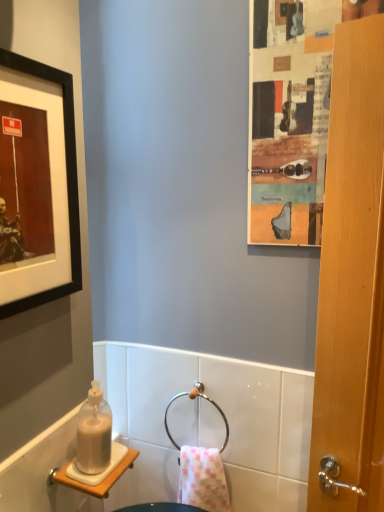
What do you see at coordinates (202, 479) in the screenshot? The width and height of the screenshot is (384, 512). I see `pink checkered towel at center` at bounding box center [202, 479].

Locate an element on the screen. This screenshot has width=384, height=512. translucent plastic bottle at lower left is located at coordinates (94, 433).

The height and width of the screenshot is (512, 384). I want to click on polished metal towel ring at center, so 192,399.

Could wooden-framed collage at upper right be considered to be inside translucent plastic bottle at lower left?

That's incorrect, wooden-framed collage at upper right is not inside translucent plastic bottle at lower left.

Who is more distant, translucent plastic bottle at lower left or wooden-framed collage at upper right?

wooden-framed collage at upper right is behind.

Is translucent plastic bottle at lower left aimed at wooden-framed collage at upper right?

No, translucent plastic bottle at lower left is not aimed at wooden-framed collage at upper right.

Is polished metal towel ring at center not near translucent plastic bottle at lower left?

polished metal towel ring at center is actually quite close to translucent plastic bottle at lower left.

Is polished metal towel ring at center positioned beyond the bounds of translucent plastic bottle at lower left?

Yes, polished metal towel ring at center is not within translucent plastic bottle at lower left.

Is polished metal towel ring at center positioned before translucent plastic bottle at lower left?

No, it is behind translucent plastic bottle at lower left.

Considering the sizes of pink checkered towel at center and translucent plastic bottle at lower left in the image, is pink checkered towel at center taller or shorter than translucent plastic bottle at lower left?

In the image, pink checkered towel at center appears to be taller than translucent plastic bottle at lower left.

From the image's perspective, would you say pink checkered towel at center is shown under translucent plastic bottle at lower left?

Indeed, from the image's perspective, pink checkered towel at center is shown beneath translucent plastic bottle at lower left.

Looking at the image, does pink checkered towel at center seem bigger or smaller compared to translucent plastic bottle at lower left?

pink checkered towel at center is bigger than translucent plastic bottle at lower left.

Is pink checkered towel at center not inside translucent plastic bottle at lower left?

Indeed, pink checkered towel at center is completely outside translucent plastic bottle at lower left.

From the image's perspective, would you say black matte picture frame at upper left is positioned over translucent plastic bottle at lower left?

Yes.

Are black matte picture frame at upper left and translucent plastic bottle at lower left making contact?

No.

Is black matte picture frame at upper left situated inside translucent plastic bottle at lower left or outside?

black matte picture frame at upper left lies outside translucent plastic bottle at lower left.

Considering the positions of point (63, 71) and point (79, 449), is point (63, 71) closer or farther from the camera than point (79, 449)?

Point (63, 71) appears to be farther away from the viewer than point (79, 449).

From a real-world perspective, who is located lower, polished metal towel ring at center or pink checkered towel at center?

From a 3D spatial view, pink checkered towel at center is below.

Could pink checkered towel at center be considered to be inside polished metal towel ring at center?

Actually, pink checkered towel at center is outside polished metal towel ring at center.

From the image's perspective, would you say polished metal towel ring at center is shown under pink checkered towel at center?

Incorrect, from the image's perspective, polished metal towel ring at center is higher than pink checkered towel at center.

Is polished metal towel ring at center completely or partially inside black matte picture frame at upper left?

No, polished metal towel ring at center is not a part of black matte picture frame at upper left.

Considering the positions of objects black matte picture frame at upper left and polished metal towel ring at center in the image provided, who is more to the right, black matte picture frame at upper left or polished metal towel ring at center?

From the viewer's perspective, polished metal towel ring at center appears more on the right side.

How many degrees apart are the facing directions of black matte picture frame at upper left and polished metal towel ring at center?

black matte picture frame at upper left and polished metal towel ring at center are facing 93.1 degrees away from each other.

Consider the image. From a real-world perspective, relative to polished metal towel ring at center, is black matte picture frame at upper left vertically above or below?

Clearly, from a real-world perspective, black matte picture frame at upper left is above polished metal towel ring at center.

Is wooden-framed collage at upper right bigger than translucent plastic bottle at lower left?

Yes.

Is wooden-framed collage at upper right not inside translucent plastic bottle at lower left?

Yes, wooden-framed collage at upper right is outside of translucent plastic bottle at lower left.

Consider the image. Considering the relative sizes of wooden-framed collage at upper right and translucent plastic bottle at lower left in the image provided, is wooden-framed collage at upper right taller than translucent plastic bottle at lower left?

Yes, wooden-framed collage at upper right is taller than translucent plastic bottle at lower left.

Is wooden-framed collage at upper right closer to the viewer compared to translucent plastic bottle at lower left?

No, wooden-framed collage at upper right is behind translucent plastic bottle at lower left.

Find the location of `poster lying above the translucent plastic bottle at lower left (from the image's perspective)`. poster lying above the translucent plastic bottle at lower left (from the image's perspective) is located at coordinates (289, 118).

The width and height of the screenshot is (384, 512). I want to click on towel bar that is behind the translucent plastic bottle at lower left, so click(192, 399).

Based on their spatial positions, is translucent plastic bottle at lower left or wooden-framed collage at upper right closer to polished metal towel ring at center?

Among the two, translucent plastic bottle at lower left is located nearer to polished metal towel ring at center.

When comparing their distances from polished metal towel ring at center, does wooden-framed collage at upper right or pink checkered towel at center seem closer?

Based on the image, pink checkered towel at center appears to be nearer to polished metal towel ring at center.

When comparing their distances from pink checkered towel at center, does black matte picture frame at upper left or wooden-framed collage at upper right seem further?

Based on the image, wooden-framed collage at upper right appears to be further to pink checkered towel at center.

Estimate the real-world distances between objects in this image. Which object is further from black matte picture frame at upper left, wooden-framed collage at upper right or pink checkered towel at center?

The object further to black matte picture frame at upper left is pink checkered towel at center.

Considering their positions, is pink checkered towel at center positioned closer to wooden-framed collage at upper right than translucent plastic bottle at lower left?

translucent plastic bottle at lower left is closer to wooden-framed collage at upper right.

From the image, which object appears to be nearer to pink checkered towel at center, translucent plastic bottle at lower left or polished metal towel ring at center?

polished metal towel ring at center lies closer to pink checkered towel at center than the other object.

When comparing their distances from black matte picture frame at upper left, does polished metal towel ring at center or translucent plastic bottle at lower left seem closer?

translucent plastic bottle at lower left.

Which object lies further to the anchor point polished metal towel ring at center, pink checkered towel at center or wooden-framed collage at upper right?

Based on the image, wooden-framed collage at upper right appears to be further to polished metal towel ring at center.

Where is `picture frame between wooden-framed collage at upper right and translucent plastic bottle at lower left in the up-down direction`? picture frame between wooden-framed collage at upper right and translucent plastic bottle at lower left in the up-down direction is located at coordinates (67, 181).

At what (x,y) coordinates should I click in order to perform the action: click on bottle between wooden-framed collage at upper right and polished metal towel ring at center from top to bottom. Please return your answer as a coordinate pair (x, y). The height and width of the screenshot is (512, 384). Looking at the image, I should click on (94, 433).

Where is `bottle between black matte picture frame at upper left and polished metal towel ring at center from top to bottom`? bottle between black matte picture frame at upper left and polished metal towel ring at center from top to bottom is located at coordinates (94, 433).

You are a GUI agent. You are given a task and a screenshot of the screen. Output one action in this format:
    pyautogui.click(x=<x>, y=<y>)
    Task: Click on the picture frame between wooden-framed collage at upper right and polished metal towel ring at center vertically
    The image size is (384, 512).
    Given the screenshot: What is the action you would take?
    pyautogui.click(x=67, y=181)